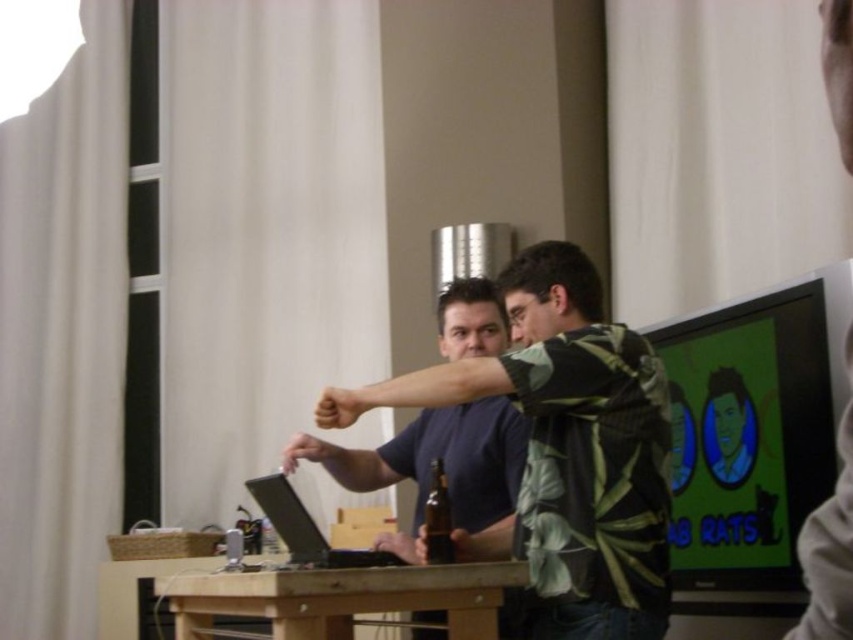
You are a delivery person who needs to place a package on the table where the matte black laptop at center and the brown glass beer bottle at center are located. The package requires a flat surface that is at least as tall as the tallest object on the table. Which object should you consider when determining the required height for the package?

The brown glass beer bottle at center is taller than the matte black laptop at center. Therefore, you should consider the brown glass beer bottle at center when determining the required height for the package since it is the tallest object on the table.

Based on the photo, you need to place a rectangular object that is 15 inches wide on the wooden table at center. Can the matte black laptop at center fit alongside it without overlapping?

The wooden table at center is wider than the matte black laptop at center, so there should be enough space to place both the 15 inch object and the laptop side by side without overlapping.

Looking at this image, you are trying to determine if the green leafy shirt at center can be placed on top of the wooden table at center without hanging over the edges. Based on their sizes, what do you think?

The green leafy shirt at center is thinner than the wooden table at center, so it can be placed on top of the wooden table at center without hanging over the edges since its width is narrower.